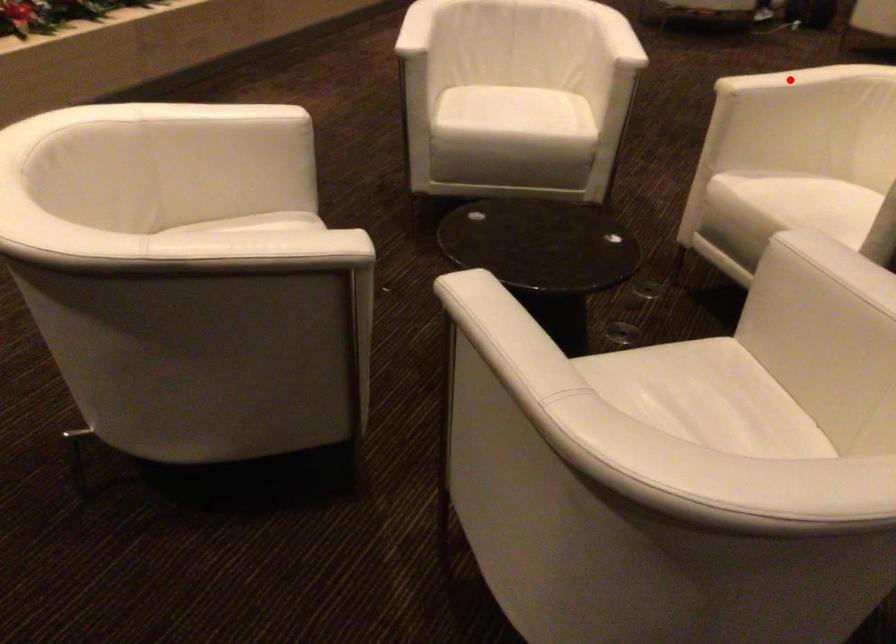
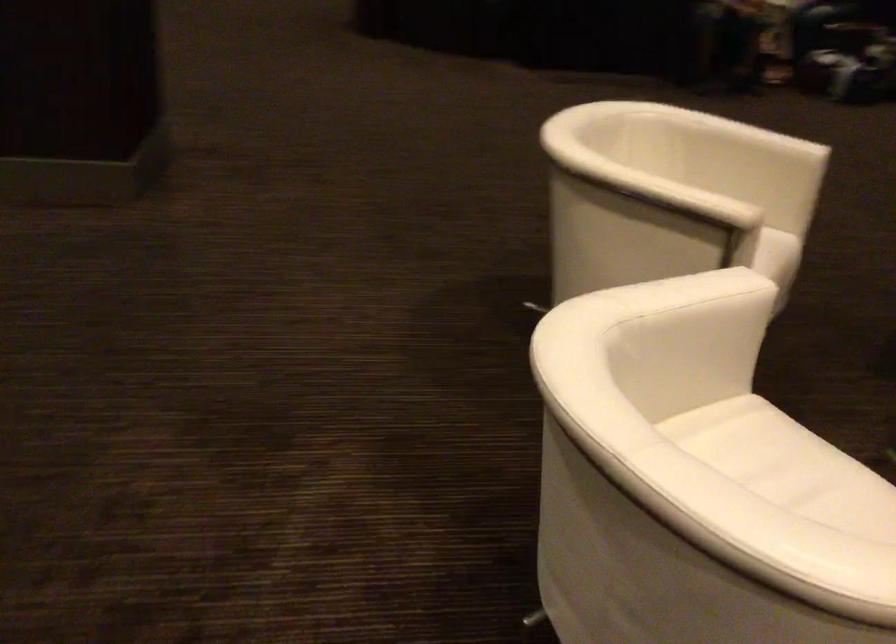
Question: I am providing you with two images of the same scene from different viewpoints. A red point is marked on the first image. At the location where the point appears in image 1, is it still visible in image 2?

Choices:
 (A) Yes
 (B) No

Answer: (B)